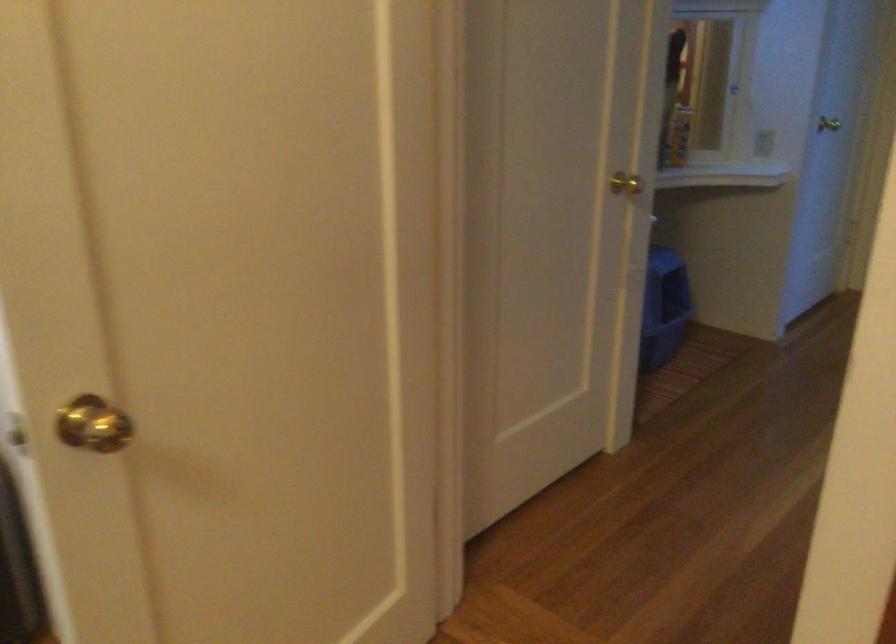
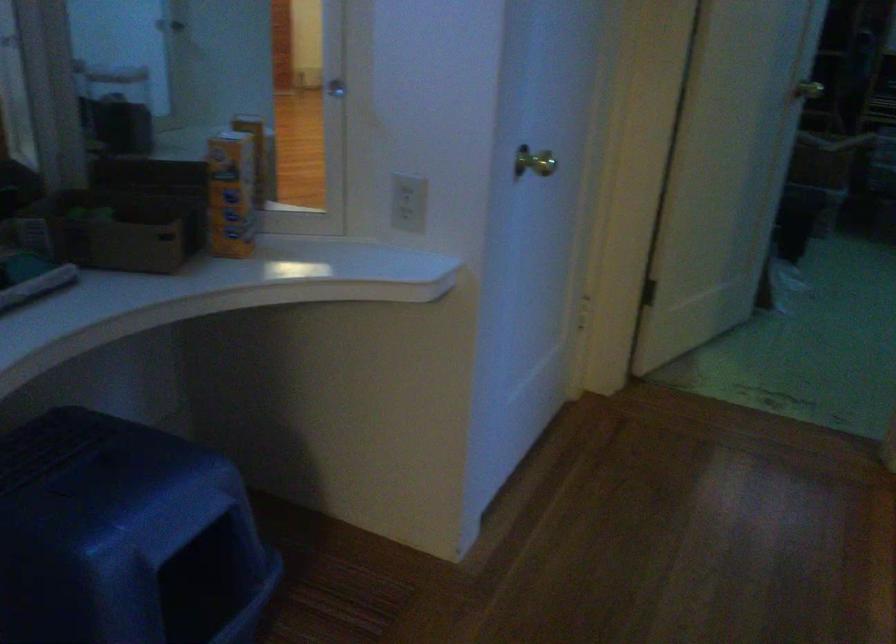
Find the pixel in the second image that matches the point at 677,131 in the first image.

(230, 194)